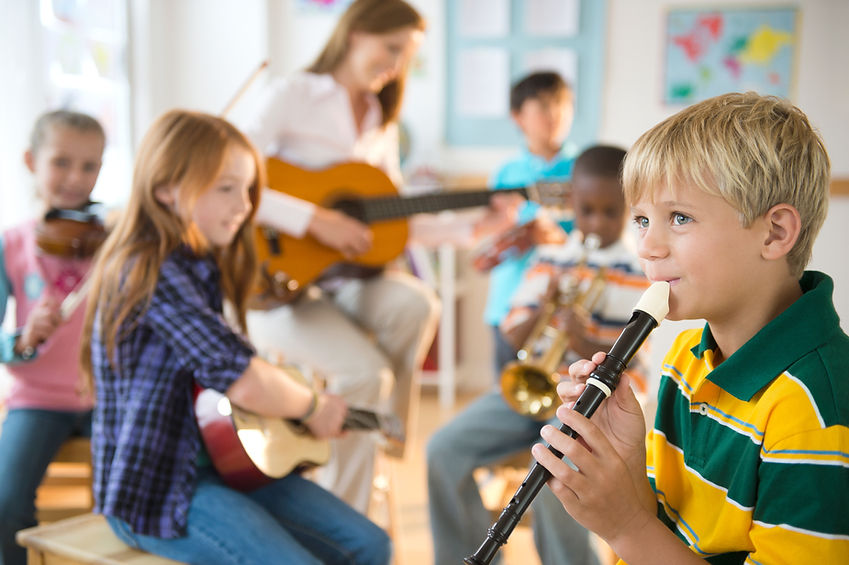
Where is `painting on wall`? painting on wall is located at coordinates (709, 56), (741, 24), (761, 43).